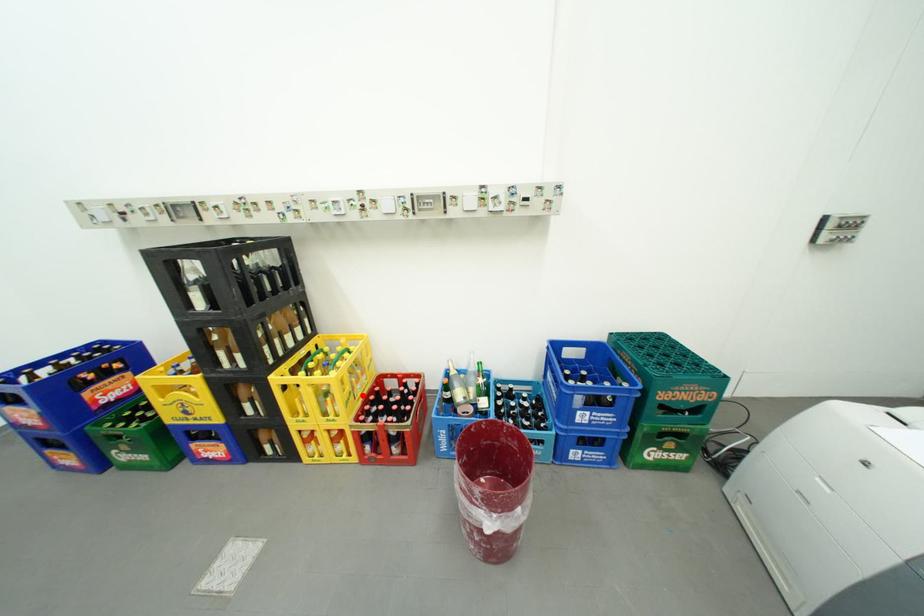
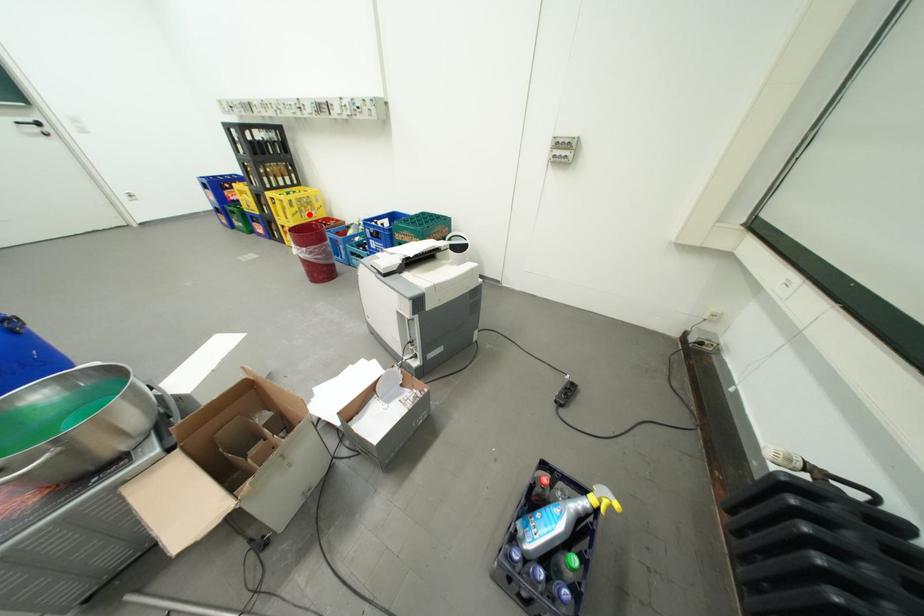
I am providing you with two images of the same scene from different viewpoints. A red point is marked on the first image and another point is marked on the second image. Do the highlighted points in image1 and image2 indicate the same real-world spot?

Yes